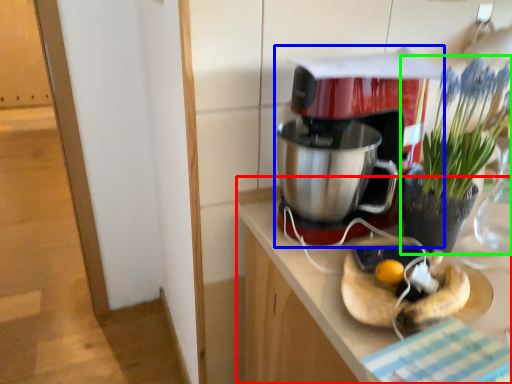
Question: Estimate the real-world distances between objects in this image. Which object is closer to counter (highlighted by a red box), coffee maker (highlighted by a blue box) or houseplant (highlighted by a green box)?

Choices:
 (A) coffee maker
 (B) houseplant

Answer: (A)